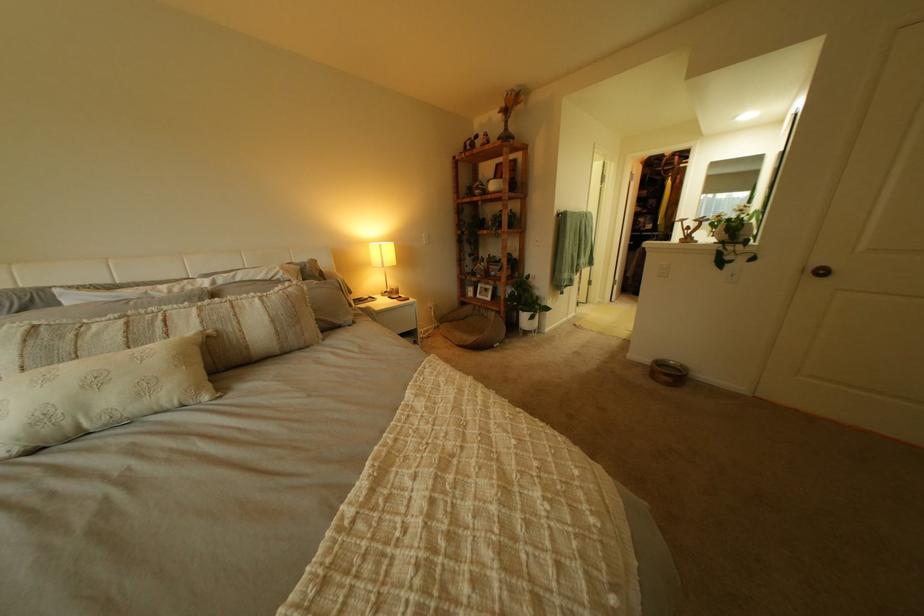
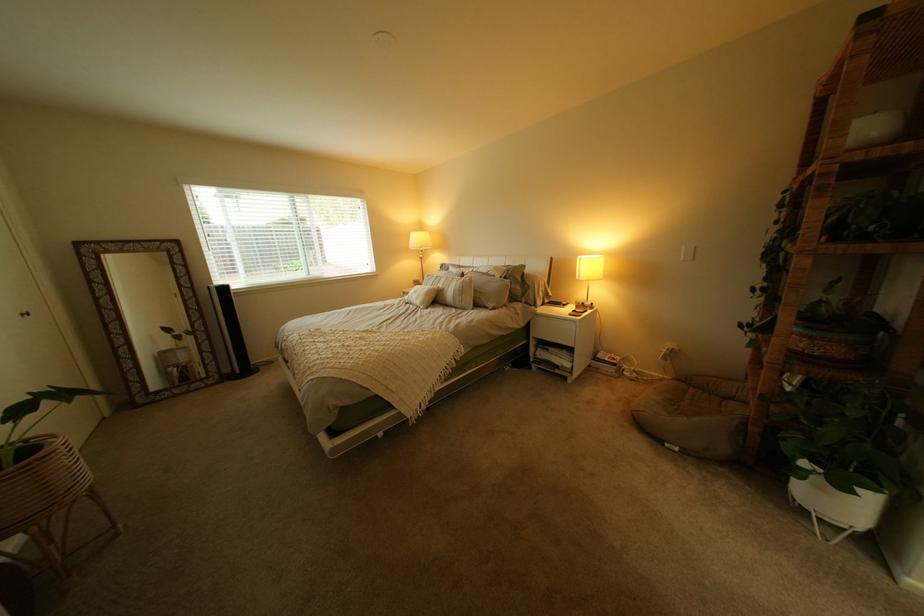
In the second image, find the point that corresponds to [112,384] in the first image.

(431, 293)